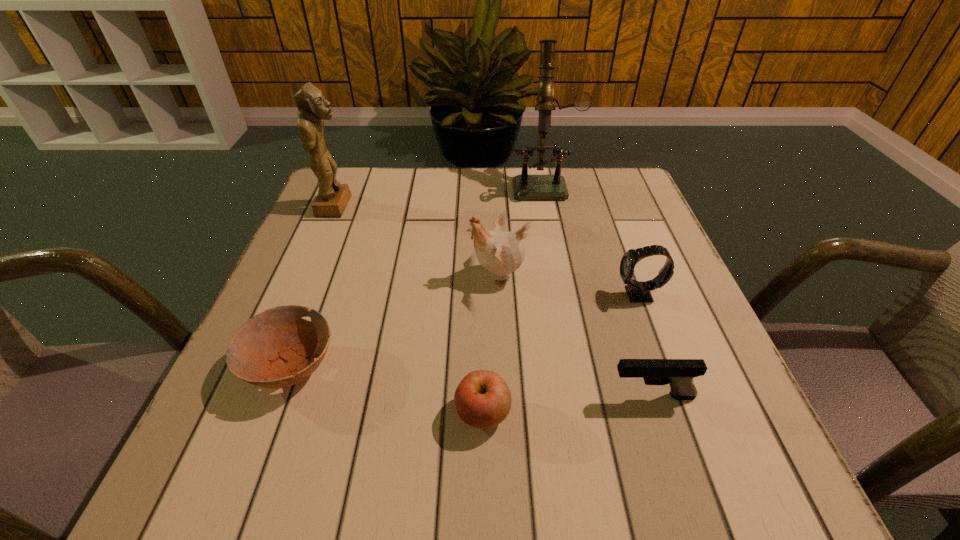
I want to click on microscope at the far edge, so click(525, 187).

This screenshot has width=960, height=540. Find the location of `figurine at the far edge`. figurine at the far edge is located at coordinates (332, 198).

The image size is (960, 540). In order to click on object at the near edge in this screenshot , I will do `click(483, 400)`.

At what (x,y) coordinates should I click in order to perform the action: click on figurine at the left edge. Please return your answer as a coordinate pair (x, y). The height and width of the screenshot is (540, 960). Looking at the image, I should click on pos(332,198).

Identify the location of bowl that is at the left edge. Image resolution: width=960 pixels, height=540 pixels. (270, 350).

Locate an element on the screen. microscope that is at the right edge is located at coordinates tap(525, 187).

This screenshot has width=960, height=540. Find the location of `watch located in the right edge section of the desktop`. watch located in the right edge section of the desktop is located at coordinates (638, 291).

This screenshot has width=960, height=540. I want to click on pistol that is at the right edge, so click(678, 373).

Image resolution: width=960 pixels, height=540 pixels. I want to click on object present at the far left corner, so click(332, 198).

I want to click on object located at the far right corner, so [x=525, y=187].